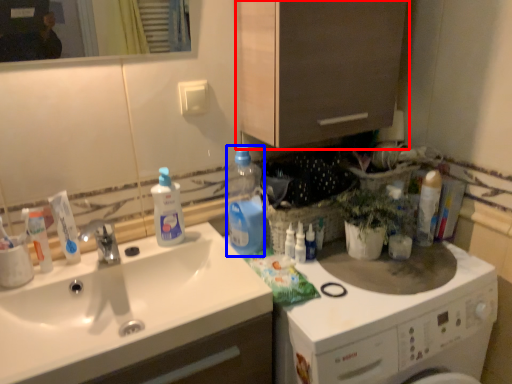
Question: Which object is closer to the camera taking this photo, cabinetry (highlighted by a red box) or cleaning product (highlighted by a blue box)?

Choices:
 (A) cabinetry
 (B) cleaning product

Answer: (A)